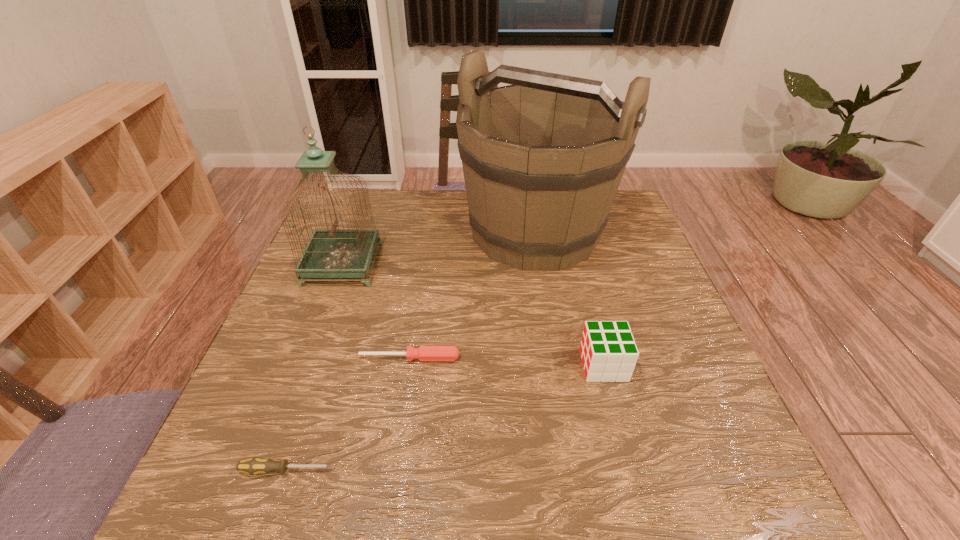
This screenshot has height=540, width=960. I want to click on free spot at the near edge of the desktop, so pos(447,475).

Locate an element on the screen. This screenshot has height=540, width=960. vacant area at the left edge is located at coordinates (294, 303).

What are the coordinates of `vacant space at the right edge of the desktop` in the screenshot? It's located at (629, 305).

In the image, there is a desktop. Identify the location of vacant space at the far left corner. (348, 203).

Locate an element on the screen. Image resolution: width=960 pixels, height=540 pixels. empty location between the tallest object and the farther screwdriver is located at coordinates (472, 295).

Find the location of `free spot between the third shortest object and the birdcage`. free spot between the third shortest object and the birdcage is located at coordinates (473, 315).

The height and width of the screenshot is (540, 960). What are the coordinates of `blank region between the second tallest object and the nearest object` in the screenshot? It's located at (315, 367).

Find the location of a particular element. Image resolution: width=960 pixels, height=540 pixels. free spot between the tallest object and the second tallest object is located at coordinates (439, 248).

Where is `vacant space that is in between the tallest object and the birdcage`? The height and width of the screenshot is (540, 960). vacant space that is in between the tallest object and the birdcage is located at coordinates (439, 248).

Where is `free space that is in between the third tallest object and the nearer screwdriver`? Image resolution: width=960 pixels, height=540 pixels. free space that is in between the third tallest object and the nearer screwdriver is located at coordinates (445, 417).